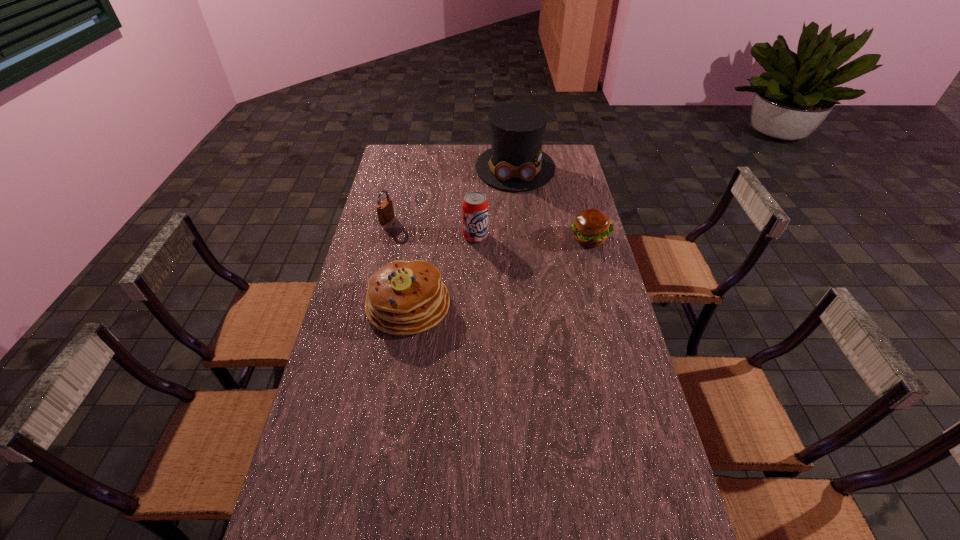
At what (x,y) coordinates should I click in order to perform the action: click on hamburger located at the right edge. Please return your answer as a coordinate pair (x, y). This screenshot has height=540, width=960. Looking at the image, I should click on (591, 227).

Where is `dress hat present at the right edge`? This screenshot has height=540, width=960. dress hat present at the right edge is located at coordinates (516, 162).

Find the location of a particular element. This screenshot has height=540, width=960. object that is at the far right corner is located at coordinates (516, 162).

Identify the location of free region at the far edge of the desktop. (423, 167).

Locate an element on the screen. The width and height of the screenshot is (960, 540). vacant area at the left edge is located at coordinates (400, 252).

Locate an element on the screen. This screenshot has width=960, height=540. vacant space at the right edge of the desktop is located at coordinates (573, 252).

Where is `blank space at the far left corner of the desktop`? This screenshot has height=540, width=960. blank space at the far left corner of the desktop is located at coordinates (410, 155).

Locate an element on the screen. The width and height of the screenshot is (960, 540). free space between the hamburger and the nearest object is located at coordinates (498, 272).

This screenshot has width=960, height=540. I want to click on vacant point located between the hamburger and the nearest object, so click(498, 272).

Find the location of a particular element. The image size is (960, 540). free spot between the fourth nearest object and the farthest object is located at coordinates (451, 194).